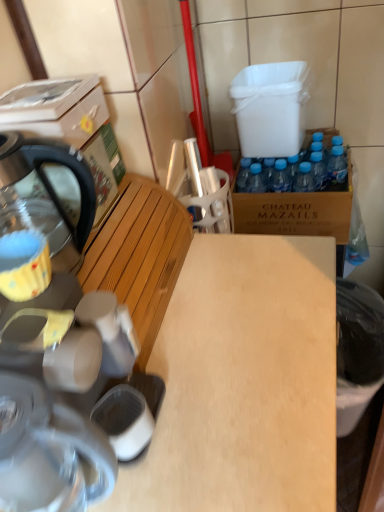
Question: Can you confirm if stainless steel kettle at left is positioned to the right of light wood desk at center?

Choices:
 (A) no
 (B) yes

Answer: (A)

Question: Could you tell me if stainless steel kettle at left is turned towards light wood desk at center?

Choices:
 (A) yes
 (B) no

Answer: (B)

Question: Is stainless steel kettle at left completely or partially outside of light wood desk at center?

Choices:
 (A) no
 (B) yes

Answer: (B)

Question: From a real-world perspective, is stainless steel kettle at left over light wood desk at center?

Choices:
 (A) no
 (B) yes

Answer: (B)

Question: From a real-world perspective, is stainless steel kettle at left under light wood desk at center?

Choices:
 (A) yes
 (B) no

Answer: (B)

Question: From the image's perspective, is stainless steel kettle at left above light wood desk at center?

Choices:
 (A) yes
 (B) no

Answer: (A)

Question: Does light wood desk at center appear on the right side of wooden bench at left?

Choices:
 (A) yes
 (B) no

Answer: (A)

Question: Is light wood desk at center behind wooden bench at left?

Choices:
 (A) no
 (B) yes

Answer: (A)

Question: Is light wood desk at center not near wooden bench at left?

Choices:
 (A) no
 (B) yes

Answer: (A)

Question: Would you say light wood desk at center contains wooden bench at left?

Choices:
 (A) no
 (B) yes

Answer: (A)

Question: Considering the relative sizes of light wood desk at center and wooden bench at left in the image provided, is light wood desk at center thinner than wooden bench at left?

Choices:
 (A) no
 (B) yes

Answer: (A)

Question: Is light wood desk at center with wooden bench at left?

Choices:
 (A) yes
 (B) no

Answer: (A)

Question: Does black plastic trash can at lower right have a lesser height compared to brown cardboard box at right?

Choices:
 (A) yes
 (B) no

Answer: (B)